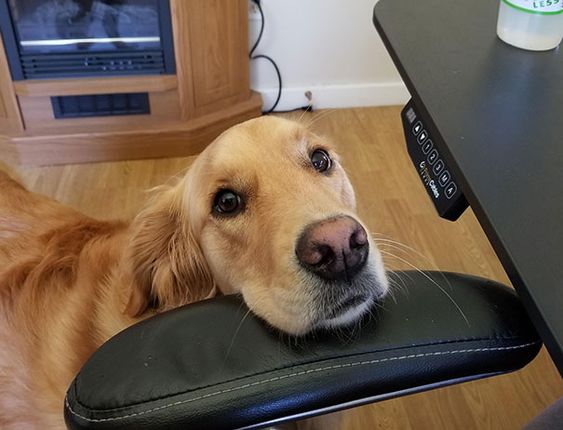
Identify the location of furniture. This screenshot has width=563, height=430. (210, 83), (482, 84), (433, 345).